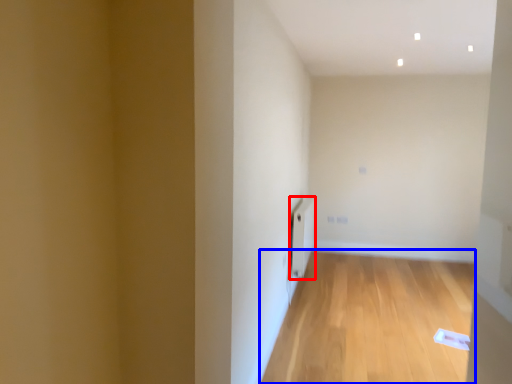
Question: Which of the following is the farthest to the observer, radiator (highlighted by a red box) or corridor (highlighted by a blue box)?

Choices:
 (A) radiator
 (B) corridor

Answer: (A)